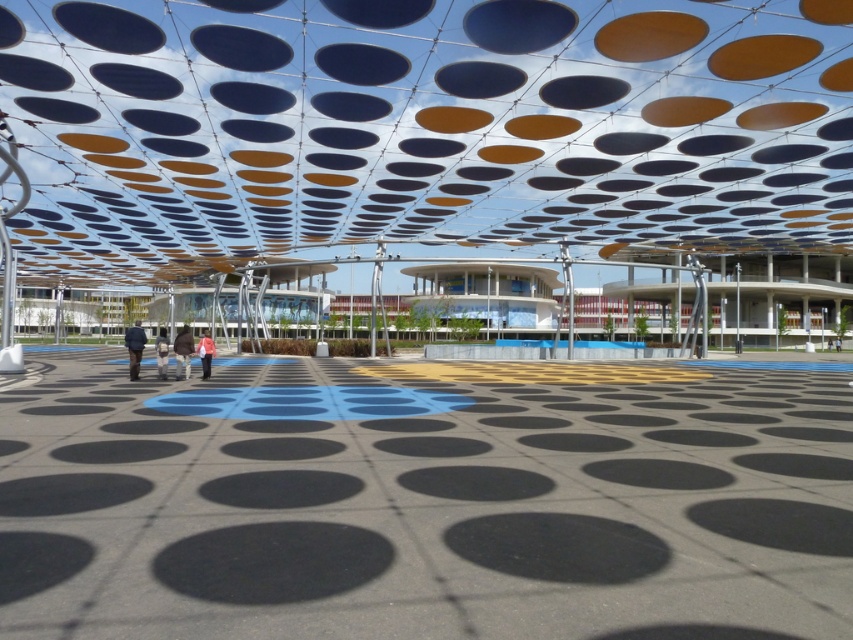
Is blue fabric jacket at center thinner than light brown leather jacket at center?

In fact, blue fabric jacket at center might be wider than light brown leather jacket at center.

You are a GUI agent. You are given a task and a screenshot of the screen. Output one action in this format:
    pyautogui.click(x=<x>, y=<y>)
    Task: Click on the blue fabric jacket at center
    This screenshot has height=640, width=853.
    Given the screenshot: What is the action you would take?
    pyautogui.click(x=134, y=348)

Locate an element on the screen. blue fabric jacket at center is located at coordinates (134, 348).

Which of these two, blue fabric jacket at center or orange fabric jacket at lower center, stands taller?

blue fabric jacket at center is taller.

Does point (132, 362) come behind point (202, 340)?

That is False.

This screenshot has height=640, width=853. I want to click on blue fabric jacket at center, so click(134, 348).

Does light brown leather jacket at center appear on the left side of orange fabric jacket at lower center?

Indeed, light brown leather jacket at center is positioned on the left side of orange fabric jacket at lower center.

Who is more forward, (160, 333) or (207, 358)?

Point (207, 358)

This screenshot has width=853, height=640. Find the location of `light brown leather jacket at center`. light brown leather jacket at center is located at coordinates (161, 353).